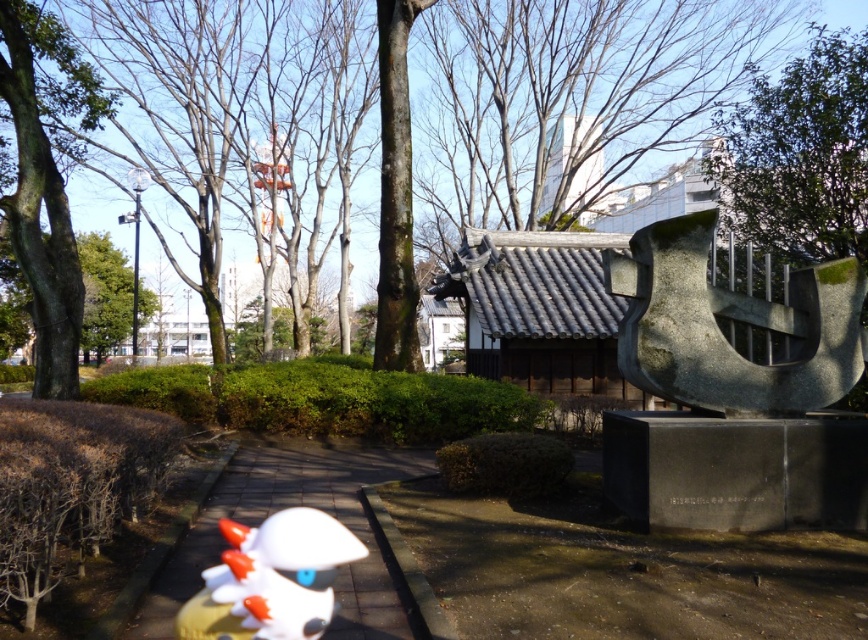
Is brown wood tree at upper center wider than green leafy tree at left?

Correct, the width of brown wood tree at upper center exceeds that of green leafy tree at left.

Between point (402, 308) and point (70, 228), which one is positioned behind?

Positioned behind is point (402, 308).

Locate an element on the screen. This screenshot has height=640, width=868. brown wood tree at upper center is located at coordinates (530, 81).

Does green leafy tree at left have a lesser width compared to brown rough tree at left?

Indeed, green leafy tree at left has a lesser width compared to brown rough tree at left.

Which is behind, point (61, 333) or point (112, 262)?

Positioned behind is point (112, 262).

The width and height of the screenshot is (868, 640). What do you see at coordinates (45, 184) in the screenshot?
I see `green leafy tree at left` at bounding box center [45, 184].

Find the location of `green leafy tree at left`. green leafy tree at left is located at coordinates (45, 184).

Who is positioned more to the left, green stone sculpture at right or green leafy tree at left?

green leafy tree at left

Is green stone sculpture at right shorter than green leafy tree at left?

Indeed, green stone sculpture at right has a lesser height compared to green leafy tree at left.

Find the location of a particular element. The image size is (868, 640). green stone sculpture at right is located at coordinates 733,317.